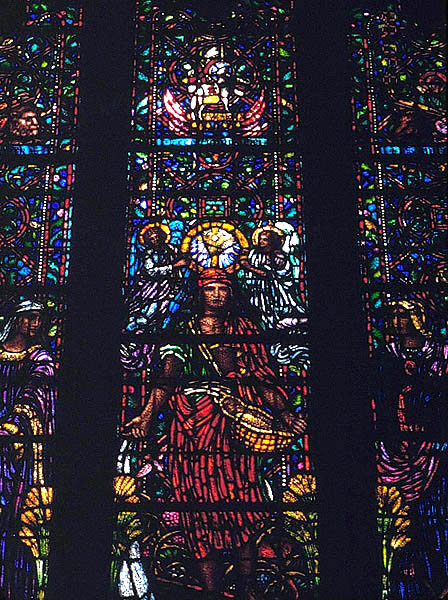
I want to click on center colored window, so click(236, 302).